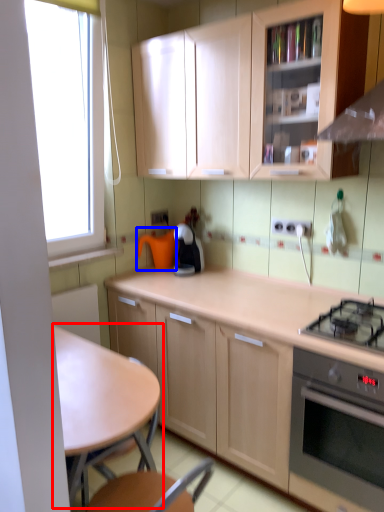
Question: Which object is further to the camera taking this photo, table (highlighted by a red box) or appliance (highlighted by a blue box)?

Choices:
 (A) table
 (B) appliance

Answer: (B)